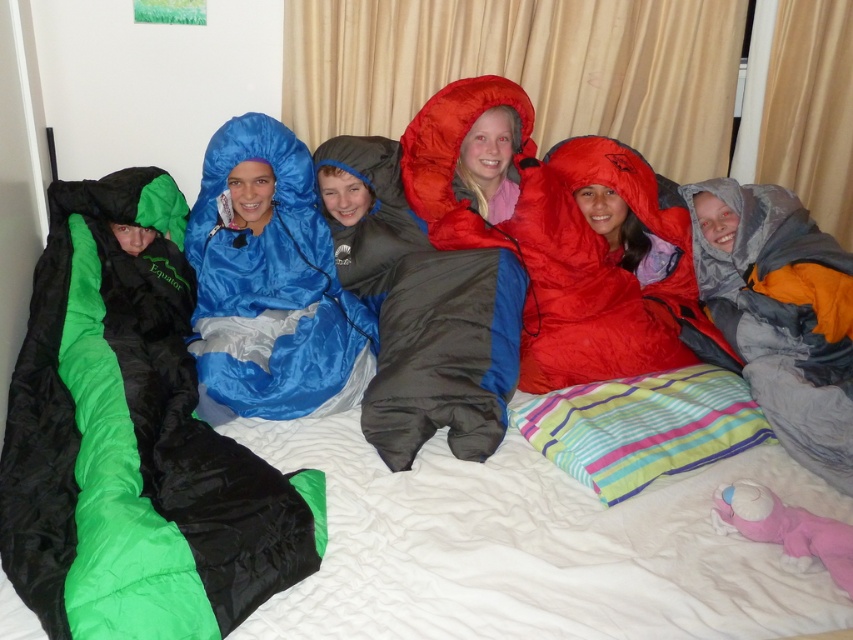
You are a photographer taking a picture of the children in the sleeping bags. You notice two points marked in the image. Which point is closer to you, point (183, 291) or point (788, 451)?

Point (183, 291) is closer to you than point (788, 451) because it is further to the viewer.